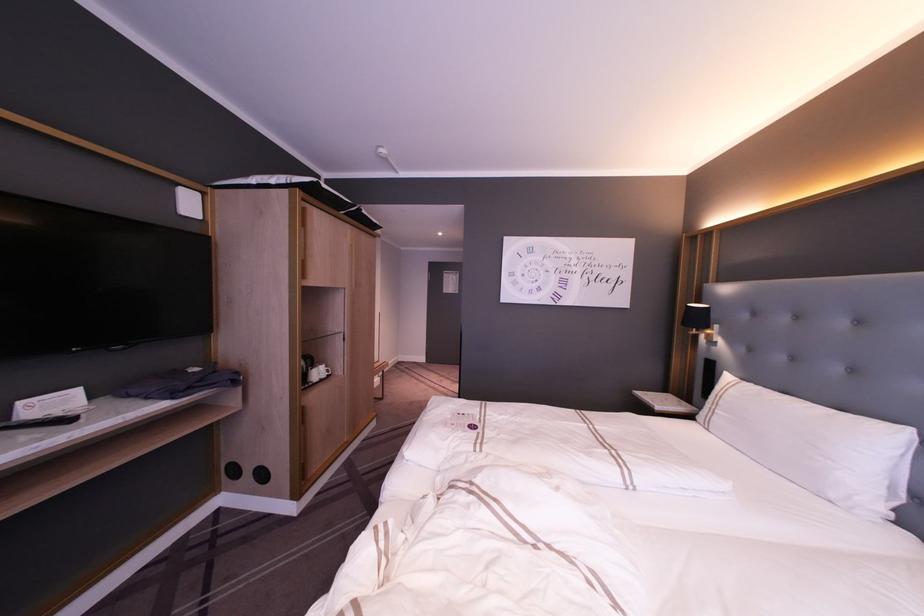
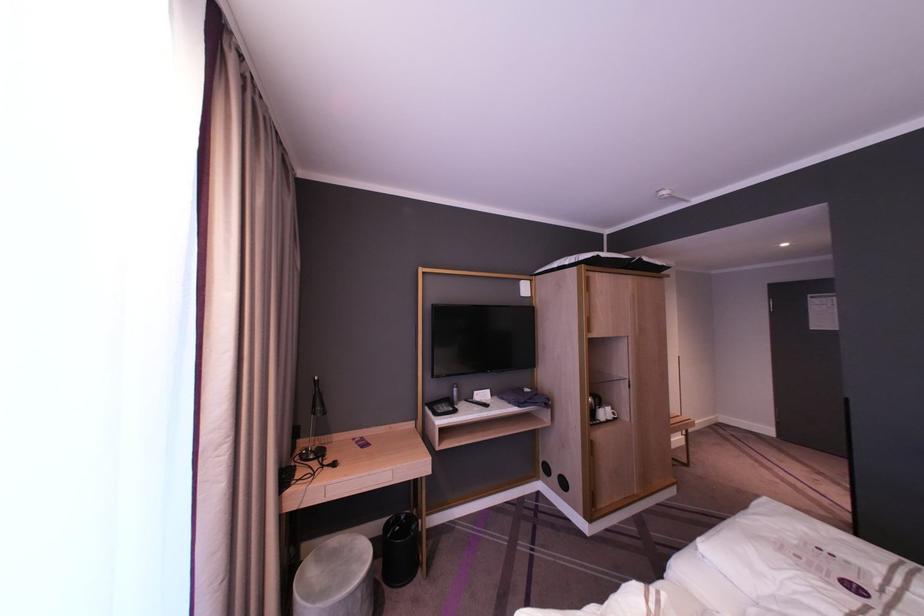
In the second image, find the point that corresponds to point (326, 370) in the first image.

(613, 413)